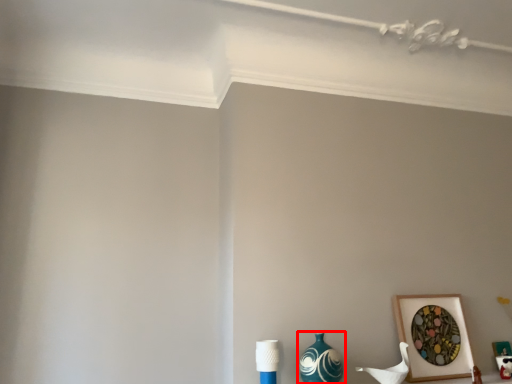
Question: Considering the relative positions of vase (annotated by the red box) and picture frame in the image provided, where is vase (annotated by the red box) located with respect to the staircase?

Choices:
 (A) right
 (B) left

Answer: (B)